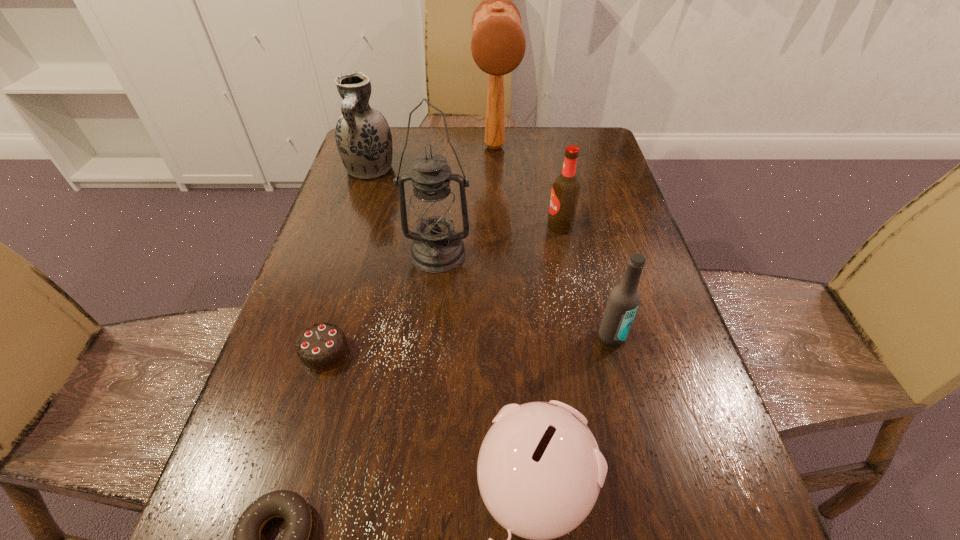
Choose which object is the third nearest neighbor to the third shortest object. Please provide its 2D coordinates. Your answer should be formatted as a tuple, i.e. [(x, y)], where the tuple contains the x and y coordinates of a point satisfying the conditions above.

[(321, 347)]